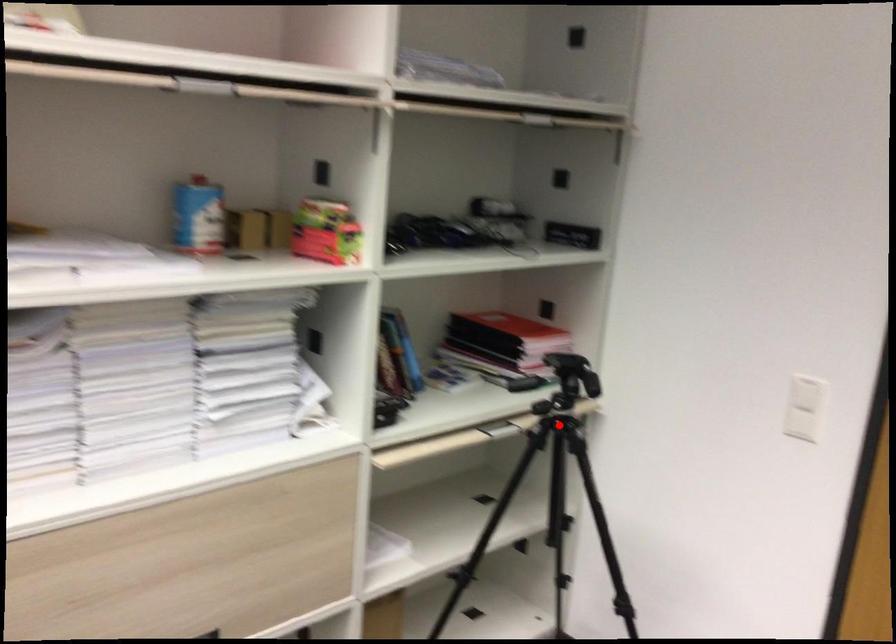
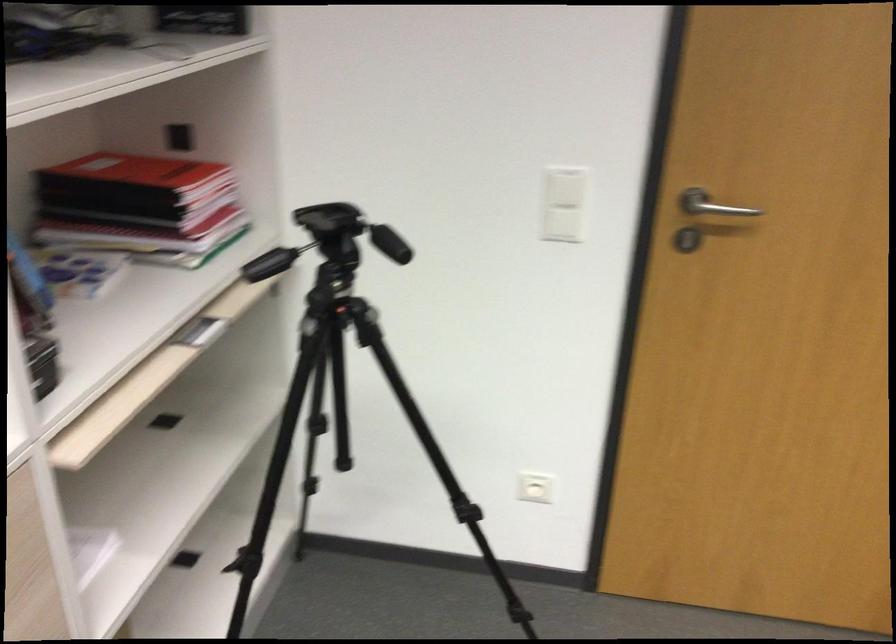
Locate, in the second image, the point that corresponds to the highlighted location in the first image.

(334, 313)